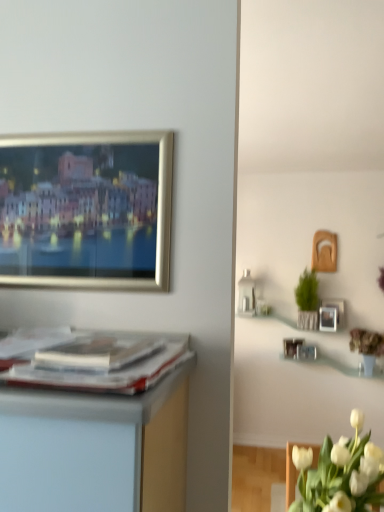
Question: Is the surface of white matte tulip at lower right in direct contact with matte silver picture frame at upper right?

Choices:
 (A) yes
 (B) no

Answer: (B)

Question: Is white matte tulip at lower right at the left side of matte silver picture frame at upper right?

Choices:
 (A) yes
 (B) no

Answer: (A)

Question: Can you confirm if white matte tulip at lower right is thinner than matte silver picture frame at upper right?

Choices:
 (A) no
 (B) yes

Answer: (A)

Question: Is white matte tulip at lower right further to camera compared to matte silver picture frame at upper right?

Choices:
 (A) no
 (B) yes

Answer: (A)

Question: From a real-world perspective, is white matte tulip at lower right physically below matte silver picture frame at upper right?

Choices:
 (A) yes
 (B) no

Answer: (A)

Question: Is point (379, 454) positioned closer to the camera than point (337, 326)?

Choices:
 (A) farther
 (B) closer

Answer: (B)

Question: Relative to matte silver picture frame at upper right, is white matte tulip at lower right in front or behind?

Choices:
 (A) front
 (B) behind

Answer: (A)

Question: Looking at their shapes, would you say white matte tulip at lower right is wider or thinner than matte silver picture frame at upper right?

Choices:
 (A) wide
 (B) thin

Answer: (A)

Question: From the image's perspective, is white matte tulip at lower right above or below matte silver picture frame at upper right?

Choices:
 (A) below
 (B) above

Answer: (A)

Question: Is matte silver picture frame at upper right in front of or behind green woven basket at upper right in the image?

Choices:
 (A) behind
 (B) front

Answer: (A)

Question: Considering the positions of matte silver picture frame at upper right and green woven basket at upper right in the image, is matte silver picture frame at upper right taller or shorter than green woven basket at upper right?

Choices:
 (A) tall
 (B) short

Answer: (B)

Question: Is matte silver picture frame at upper right bigger or smaller than green woven basket at upper right?

Choices:
 (A) big
 (B) small

Answer: (B)

Question: Do you think matte silver picture frame at upper right is within green woven basket at upper right, or outside of it?

Choices:
 (A) inside
 (B) outside

Answer: (B)

Question: Is white matte tulip at lower right in front of or behind green woven basket at upper right in the image?

Choices:
 (A) behind
 (B) front

Answer: (B)

Question: From the image's perspective, relative to green woven basket at upper right, is white matte tulip at lower right above or below?

Choices:
 (A) below
 (B) above

Answer: (A)